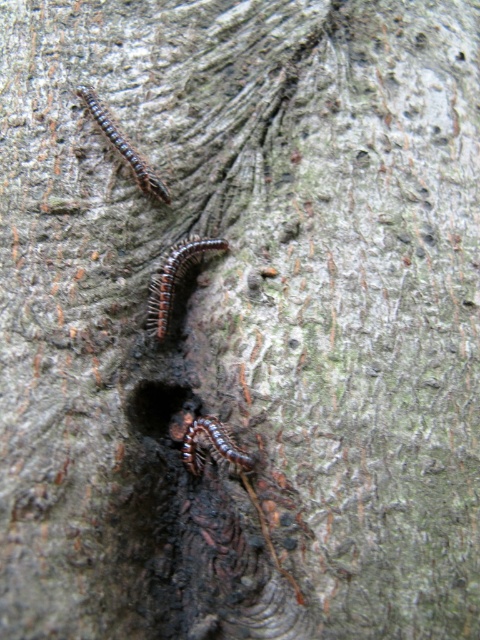
Is brown scaly centipede at center thinner than brown scaly centipede at upper left?

Indeed, brown scaly centipede at center has a lesser width compared to brown scaly centipede at upper left.

Can you confirm if brown scaly centipede at center is smaller than brown scaly centipede at upper left?

Actually, brown scaly centipede at center might be larger than brown scaly centipede at upper left.

Which is in front, point (158, 273) or point (113, 131)?

Point (158, 273) is in front.

Locate an element on the screen. brown scaly centipede at center is located at coordinates (175, 280).

Who is taller, brown scaly centipede at center or brown shiny centipede at center?

brown scaly centipede at center is taller.

Who is lower down, brown scaly centipede at center or brown shiny centipede at center?

brown shiny centipede at center

Identify the location of brown scaly centipede at center. [x=175, y=280].

Find the location of `brown scaly centipede at center`. brown scaly centipede at center is located at coordinates (175, 280).

Can you confirm if brown shiny centipede at center is positioned below brown scaly centipede at upper left?

Yes.

Which of these two, brown shiny centipede at center or brown scaly centipede at upper left, stands taller?

With more height is brown scaly centipede at upper left.

You are a GUI agent. You are given a task and a screenshot of the screen. Output one action in this format:
    pyautogui.click(x=<x>, y=<y>)
    Task: Click on the brown shiny centipede at center
    This screenshot has height=640, width=480.
    Given the screenshot: What is the action you would take?
    pyautogui.click(x=213, y=445)